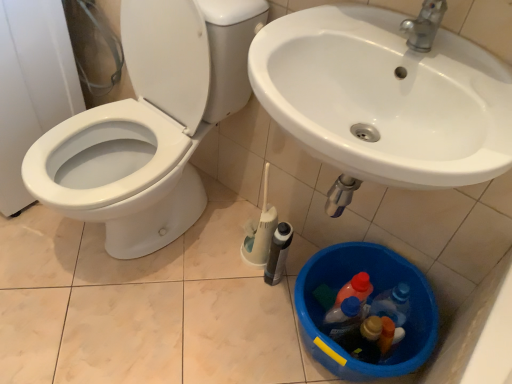
Question: Can you confirm if white glossy toilet at left is thinner than blue plastic bucket at lower center?

Choices:
 (A) no
 (B) yes

Answer: (A)

Question: From the image's perspective, is white glossy toilet at left under blue plastic bucket at lower center?

Choices:
 (A) no
 (B) yes

Answer: (A)

Question: Considering the relative positions of white glossy toilet at left and blue plastic bucket at lower center in the image provided, is white glossy toilet at left in front of blue plastic bucket at lower center?

Choices:
 (A) yes
 (B) no

Answer: (A)

Question: Can blue plastic bucket at lower center be found inside white glossy toilet at left?

Choices:
 (A) yes
 (B) no

Answer: (B)

Question: Can you confirm if white glossy toilet at left is shorter than blue plastic bucket at lower center?

Choices:
 (A) yes
 (B) no

Answer: (B)

Question: Does white glossy toilet at left have a greater height compared to blue plastic bucket at lower center?

Choices:
 (A) no
 (B) yes

Answer: (B)

Question: Can you confirm if blue plastic bucket at lower center is taller than white glossy toilet at left?

Choices:
 (A) no
 (B) yes

Answer: (A)

Question: From the image's perspective, is blue plastic bucket at lower center under white glossy toilet at left?

Choices:
 (A) yes
 (B) no

Answer: (A)

Question: Is blue plastic bucket at lower center at the left side of white glossy toilet at left?

Choices:
 (A) yes
 (B) no

Answer: (B)

Question: Could white glossy toilet at left be considered to be inside blue plastic bucket at lower center?

Choices:
 (A) no
 (B) yes

Answer: (A)

Question: Is blue plastic bucket at lower center to the right of white glossy toilet at left from the viewer's perspective?

Choices:
 (A) no
 (B) yes

Answer: (B)

Question: Can you confirm if blue plastic bucket at lower center is bigger than white glossy toilet at left?

Choices:
 (A) yes
 (B) no

Answer: (B)

Question: From the image's perspective, is white glossy toilet at left positioned above or below blue plastic bucket at lower center?

Choices:
 (A) below
 (B) above

Answer: (B)